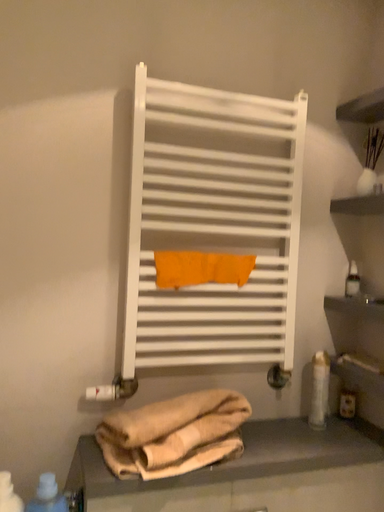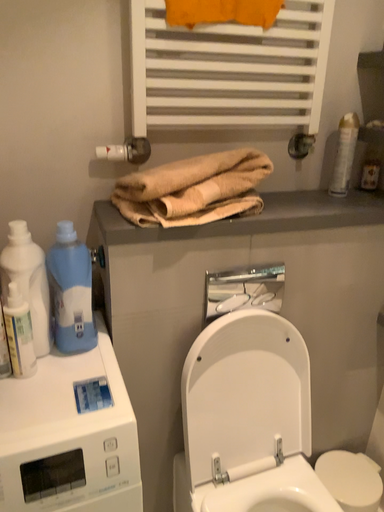
Question: Which way did the camera rotate in the video?

Choices:
 (A) rotated upward
 (B) rotated downward

Answer: (B)